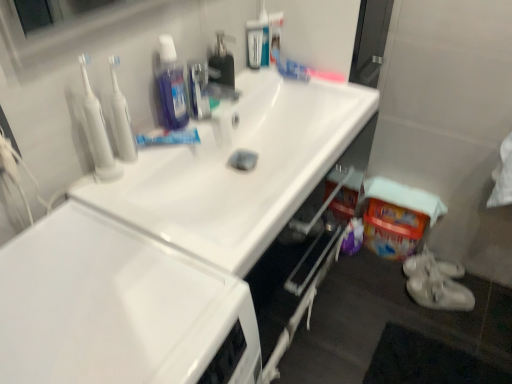
Locate an element on the screen. free location in front of white plastic toothbrushes at upper left, which is the second cleanser from right to left is located at coordinates [108, 194].